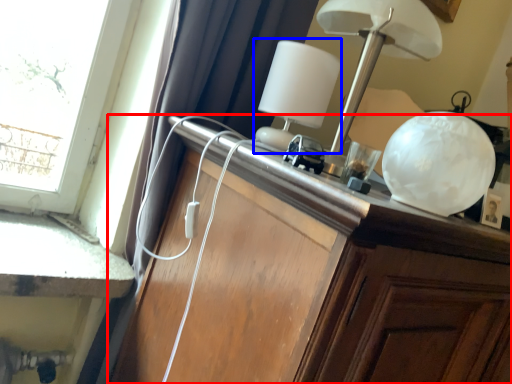
Question: Which point is further to the camera, cabinetry (highlighted by a red box) or table lamp (highlighted by a blue box)?

Choices:
 (A) cabinetry
 (B) table lamp

Answer: (B)